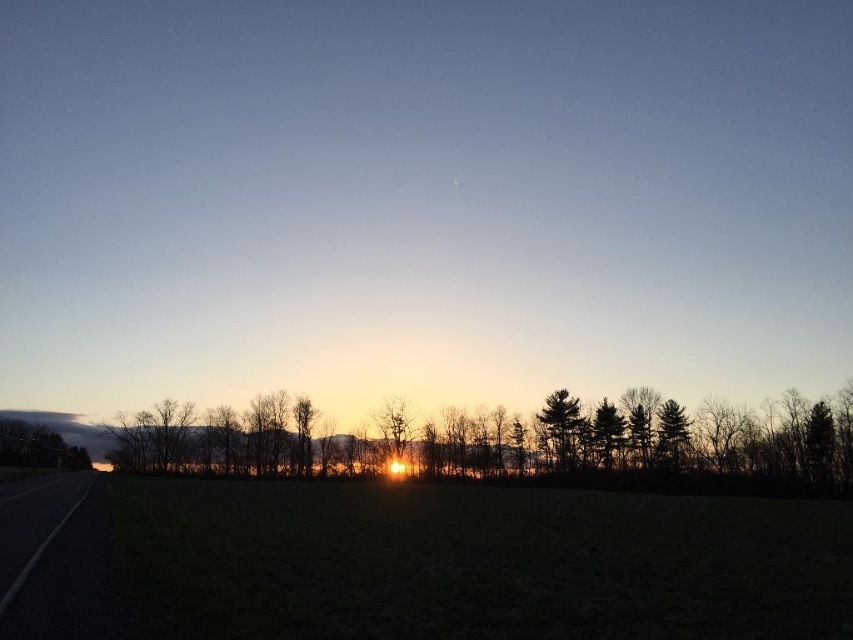
You are driving along the black asphalt highway at lower left and want to reach the dark green textured tree at center right. Is the tree located to your left or right side while driving?

The dark green textured tree at center right is located to your right side because the black asphalt highway at lower left is to the left of it.

Based on the scene description, what object is located at the coordinates point (515, 444)?

The point (515, 444) corresponds to the silhouette trees at center.

You are a photographer planning to capture the sunrise over the horizon. You have a camera with a 35mm lens that can capture a wide angle. You see the black asphalt highway at lower left and the dark green textured tree at center right in your viewfinder. Which object will appear wider in the photo?

The black asphalt highway at lower left will appear wider in the photo because its width is larger than the dark green textured tree at center right according to the description.